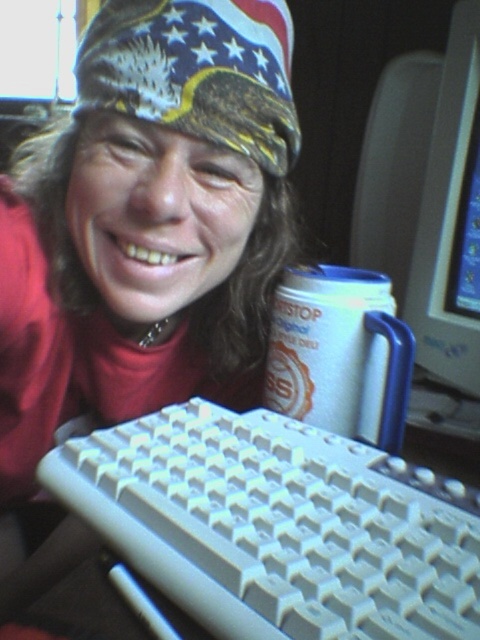
Question: Among these points, which one is nearest to the camera?

Choices:
 (A) (154, 420)
 (B) (208, 99)
 (C) (466, 22)

Answer: (B)

Question: Does white plastic keyboard at lower center have a smaller size compared to white paper cup at center?

Choices:
 (A) no
 (B) yes

Answer: (A)

Question: Does white paper cup at center have a larger size compared to matte plastic monitor at upper right?

Choices:
 (A) no
 (B) yes

Answer: (A)

Question: Estimate the real-world distances between objects in this image. Which object is farther from the american flag bandana at upper center?

Choices:
 (A) matte plastic keyboard at lower center
 (B) matte plastic monitor at upper right
 (C) white plastic keyboard at lower center

Answer: (C)

Question: Which is farther from the matte plastic monitor at upper right?

Choices:
 (A) white paper cup at center
 (B) matte plastic keyboard at lower center
 (C) white plastic keyboard at lower center
 (D) american flag bandana at upper center

Answer: (C)

Question: Is white plastic keyboard at lower center wider than matte plastic monitor at upper right?

Choices:
 (A) no
 (B) yes

Answer: (B)